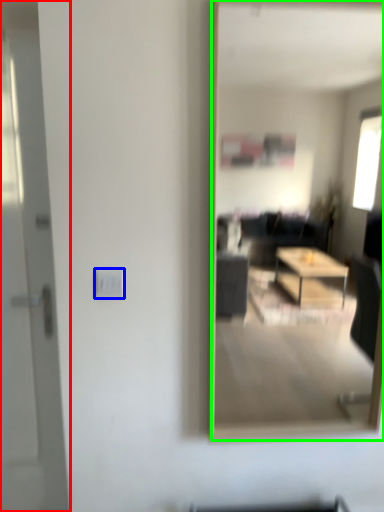
Question: Based on their relative distances, which object is farther from door (highlighted by a red box)? Choose from electric outlet (highlighted by a blue box) and mirror (highlighted by a green box).

Choices:
 (A) electric outlet
 (B) mirror

Answer: (B)